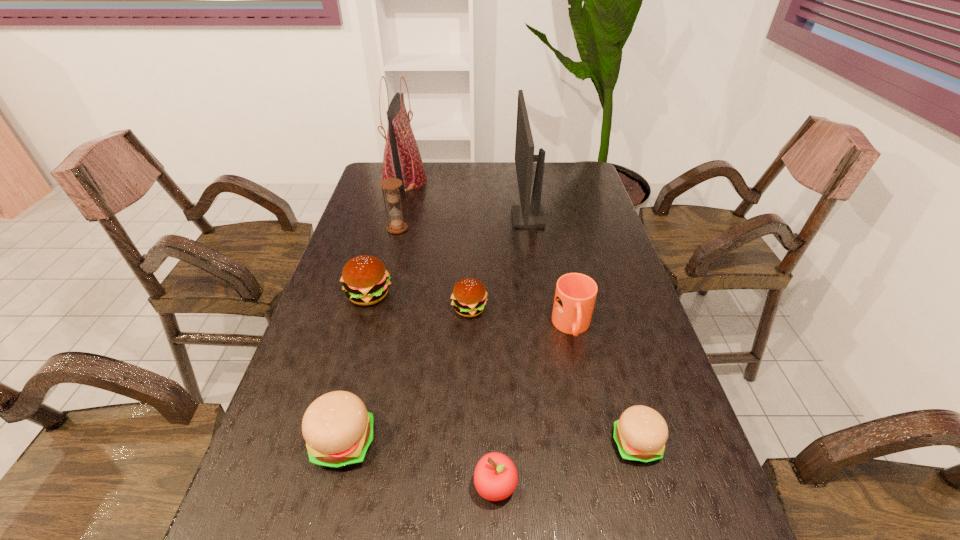
The height and width of the screenshot is (540, 960). Identify the location of handbag. (402, 160).

The image size is (960, 540). Find the location of `computer monitor`. computer monitor is located at coordinates pos(527,215).

Identify the location of hourglass. The height and width of the screenshot is (540, 960). (397, 225).

I want to click on brown hourglass, so click(397, 225).

Where is `mug`? Image resolution: width=960 pixels, height=540 pixels. mug is located at coordinates (575, 295).

Locate an element on the screen. The width and height of the screenshot is (960, 540). the left brown hamburger is located at coordinates (365, 279).

Find the location of a particular element. the bigger beige hamburger is located at coordinates 338,430.

You are a GUI agent. You are given a task and a screenshot of the screen. Output one action in this format:
    pyautogui.click(x=<x>, y=<y>)
    Task: Click on the apple
    The height and width of the screenshot is (540, 960).
    Given the screenshot: What is the action you would take?
    pyautogui.click(x=495, y=477)

Image resolution: width=960 pixels, height=540 pixels. What are the coordinates of `the smaller brown hamburger` in the screenshot? It's located at (469, 296).

You are a GUI agent. You are given a task and a screenshot of the screen. Output one action in this format:
    pyautogui.click(x=<x>, y=<y>)
    Task: Click on the right brown hamburger
    The image size is (960, 540).
    Given the screenshot: What is the action you would take?
    pyautogui.click(x=469, y=296)